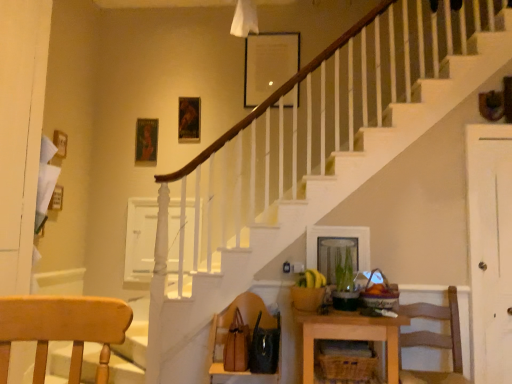
Question: Which direction should I rotate to look at brown leather handbag at lower center, the 1th chair when ordered from left to right?

Choices:
 (A) right
 (B) left

Answer: (B)

Question: Is the depth of white wood door at right less than that of woven brown basket at lower center?

Choices:
 (A) yes
 (B) no

Answer: (B)

Question: Is white wood door at right oriented towards woven brown basket at lower center?

Choices:
 (A) yes
 (B) no

Answer: (B)

Question: Considering the relative positions of white wood door at right and woven brown basket at lower center in the image provided, is white wood door at right to the right of woven brown basket at lower center from the viewer's perspective?

Choices:
 (A) no
 (B) yes

Answer: (B)

Question: From a real-world perspective, is white wood door at right located higher than woven brown basket at lower center?

Choices:
 (A) yes
 (B) no

Answer: (A)

Question: Does white wood door at right have a greater width compared to woven brown basket at lower center?

Choices:
 (A) yes
 (B) no

Answer: (B)

Question: From the image's perspective, is white wood door at right located above woven brown basket at lower center?

Choices:
 (A) no
 (B) yes

Answer: (B)

Question: From a real-world perspective, is brown leather handbag at lower center, which ranks as the 2th chair in right-to-left order, on woven brown basket at lower center?

Choices:
 (A) yes
 (B) no

Answer: (A)

Question: Considering the relative positions of brown leather handbag at lower center, the 1th chair when ordered from left to right, and woven brown basket at lower center in the image provided, is brown leather handbag at lower center, the 1th chair when ordered from left to right, to the right of woven brown basket at lower center from the viewer's perspective?

Choices:
 (A) yes
 (B) no

Answer: (B)

Question: From the image's perspective, is brown leather handbag at lower center, which ranks as the 2th chair in right-to-left order, below woven brown basket at lower center?

Choices:
 (A) no
 (B) yes

Answer: (A)

Question: From a real-world perspective, is brown leather handbag at lower center, the 1th chair when ordered from left to right, below woven brown basket at lower center?

Choices:
 (A) yes
 (B) no

Answer: (B)

Question: Is brown leather handbag at lower center, the 1th chair when ordered from left to right, looking in the opposite direction of woven brown basket at lower center?

Choices:
 (A) no
 (B) yes

Answer: (A)

Question: Is brown leather handbag at lower center, which ranks as the 2th chair in right-to-left order, thinner than woven brown basket at lower center?

Choices:
 (A) no
 (B) yes

Answer: (A)

Question: Is wooden table at lower center not inside woven brown basket at lower center?

Choices:
 (A) no
 (B) yes

Answer: (B)